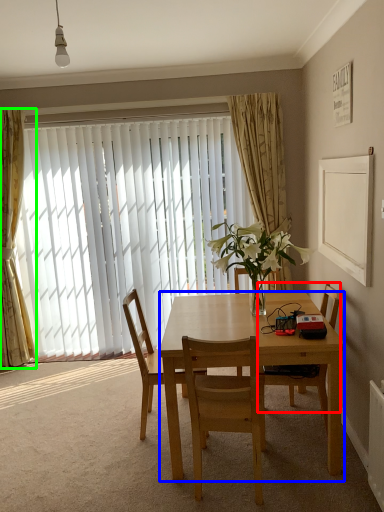
Question: Which object is the farthest from chair (highlighted by a red box)? Choose among these: desk (highlighted by a blue box) or curtain (highlighted by a green box).

Choices:
 (A) desk
 (B) curtain

Answer: (B)